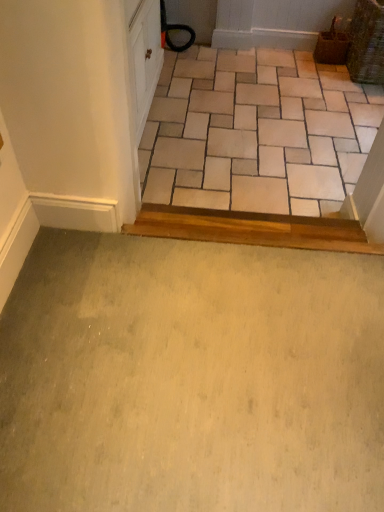
Question: Considering the positions of beige ceramic tile at upper center and green carpet at lower center in the image, is beige ceramic tile at upper center taller or shorter than green carpet at lower center?

Choices:
 (A) short
 (B) tall

Answer: (B)

Question: Is point (258, 181) closer or farther from the camera than point (230, 412)?

Choices:
 (A) closer
 (B) farther

Answer: (B)

Question: From a real-world perspective, is beige ceramic tile at upper center positioned above or below green carpet at lower center?

Choices:
 (A) above
 (B) below

Answer: (B)

Question: Considering the relative positions of green carpet at lower center and beige ceramic tile at upper center in the image provided, is green carpet at lower center to the left or to the right of beige ceramic tile at upper center?

Choices:
 (A) right
 (B) left

Answer: (B)

Question: Is green carpet at lower center in front of or behind beige ceramic tile at upper center in the image?

Choices:
 (A) front
 (B) behind

Answer: (A)

Question: From the image's perspective, is green carpet at lower center above or below beige ceramic tile at upper center?

Choices:
 (A) below
 (B) above

Answer: (A)

Question: Which is correct: green carpet at lower center is inside beige ceramic tile at upper center, or outside of it?

Choices:
 (A) outside
 (B) inside

Answer: (A)